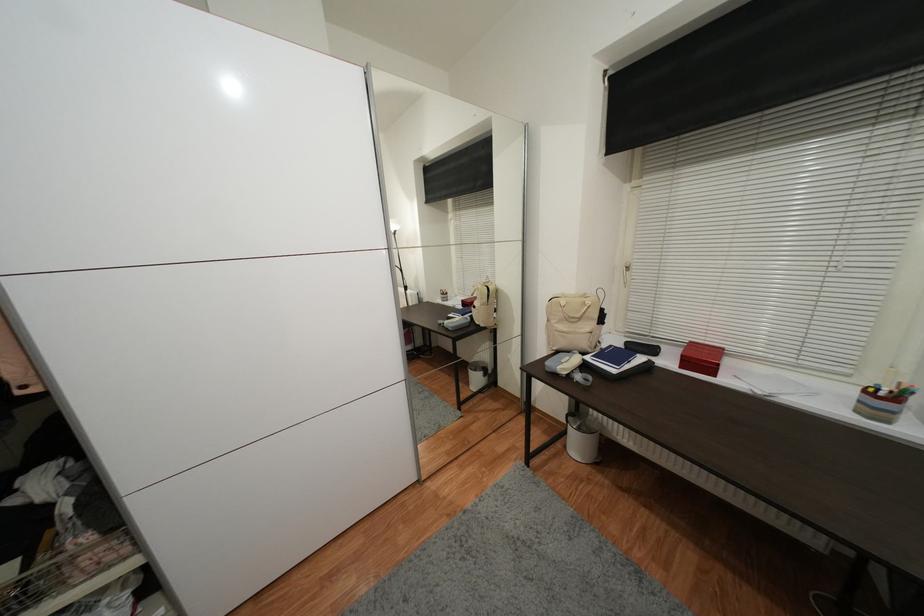
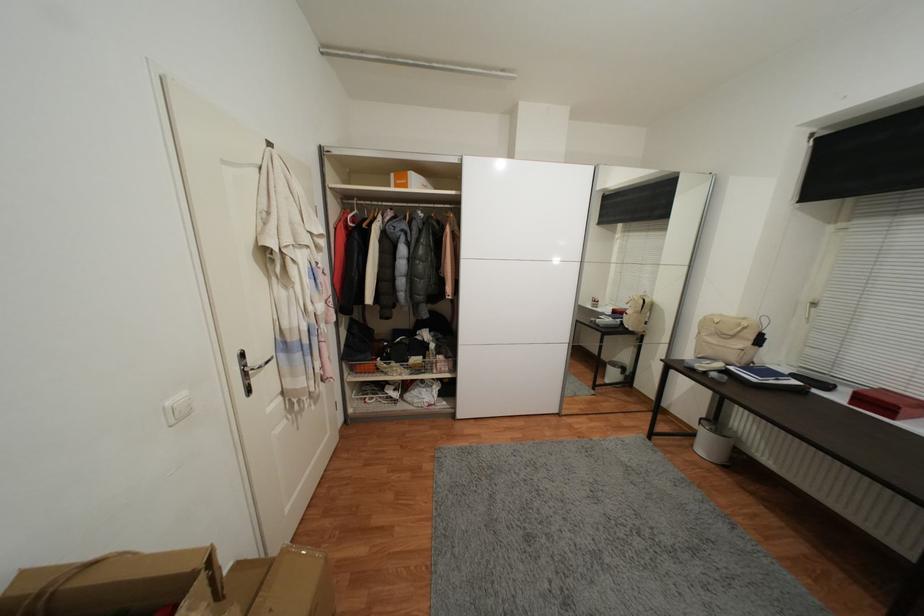
Locate, in the second image, the point that corresponds to the point at 569,448 in the first image.

(697, 447)